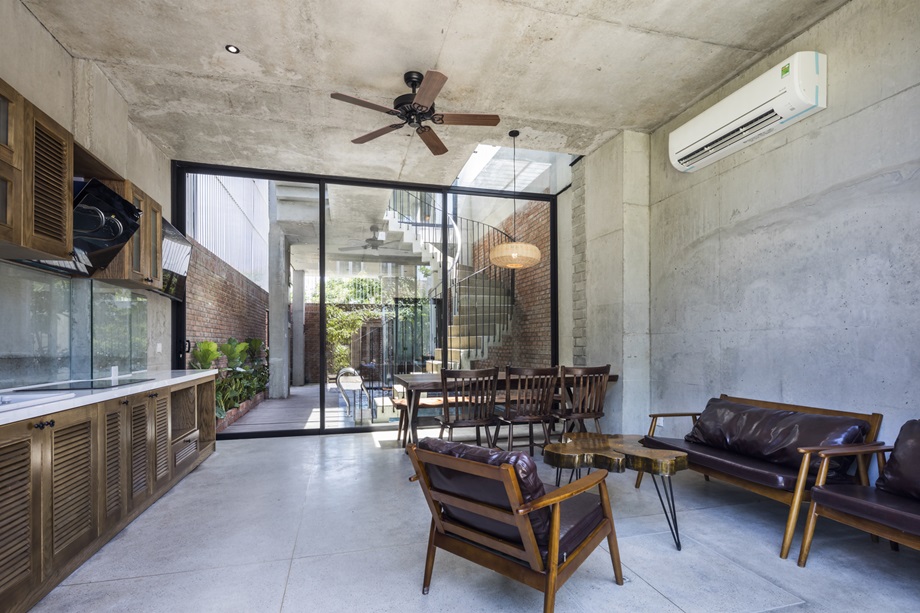
The width and height of the screenshot is (920, 613). I want to click on marble counter, so click(167, 376), click(84, 394).